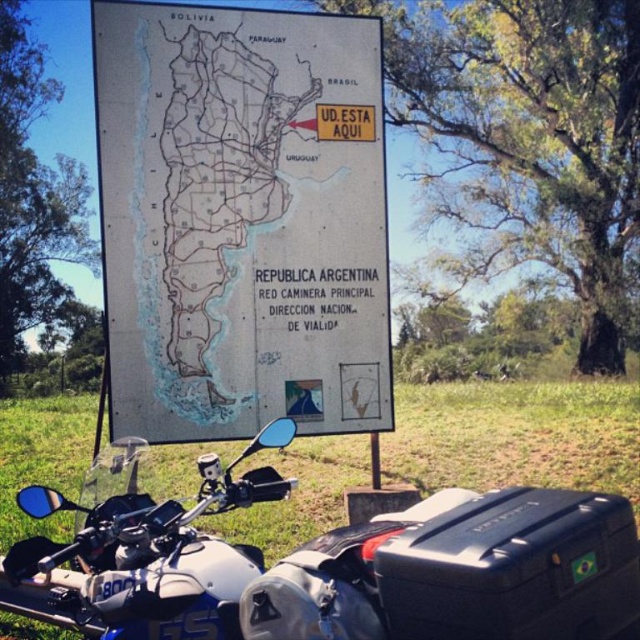
Question: Which of the following is the closest to the observer?

Choices:
 (A) silver metallic motorcycle at lower left
 (B) gray paper map at center

Answer: (A)

Question: Can you confirm if gray paper map at center is wider than silver metallic motorcycle at lower left?

Choices:
 (A) no
 (B) yes

Answer: (B)

Question: Does gray paper map at center have a greater width compared to silver metallic motorcycle at lower left?

Choices:
 (A) yes
 (B) no

Answer: (A)

Question: Among these objects, which one is farthest from the camera?

Choices:
 (A) gray paper map at center
 (B) silver metallic motorcycle at lower left

Answer: (A)

Question: Among these objects, which one is farthest from the camera?

Choices:
 (A) gray paper map at center
 (B) silver metallic motorcycle at lower left

Answer: (A)

Question: Is gray paper map at center positioned in front of silver metallic motorcycle at lower left?

Choices:
 (A) no
 (B) yes

Answer: (A)